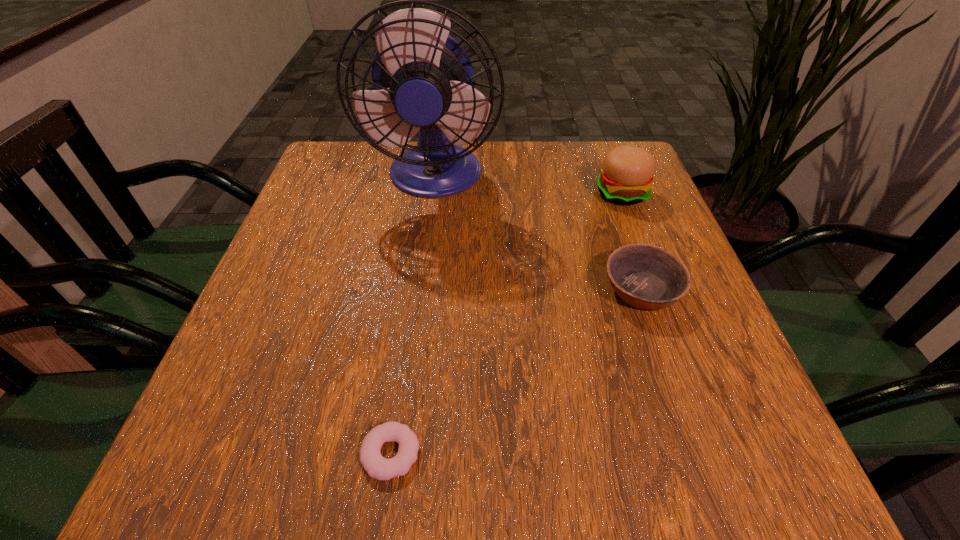
The height and width of the screenshot is (540, 960). In order to click on fan positioned at the far edge in this screenshot , I will do `click(423, 80)`.

Where is `hamburger at the far edge`? The width and height of the screenshot is (960, 540). hamburger at the far edge is located at coordinates (626, 178).

Identify the location of object situated at the near edge. The width and height of the screenshot is (960, 540). (376, 466).

Identify the location of object present at the left edge. (423, 80).

Find the location of `hamburger that is positioned at the right edge`. hamburger that is positioned at the right edge is located at coordinates (626, 178).

Where is `bowl located in the right edge section of the desktop`? The height and width of the screenshot is (540, 960). bowl located in the right edge section of the desktop is located at coordinates (647, 277).

The image size is (960, 540). What are the coordinates of `object located at the far left corner` in the screenshot? It's located at (423, 80).

At what (x,y) coordinates should I click in order to perform the action: click on object that is at the far right corner. Please return your answer as a coordinate pair (x, y). Looking at the image, I should click on (626, 178).

You are a GUI agent. You are given a task and a screenshot of the screen. Output one action in this format:
    pyautogui.click(x=<x>, y=<y>)
    Task: Click on the free region at the far edge
    
    Given the screenshot: What is the action you would take?
    pyautogui.click(x=498, y=168)

Where is `free space at the left edge of the desktop`? Image resolution: width=960 pixels, height=540 pixels. free space at the left edge of the desktop is located at coordinates (342, 249).